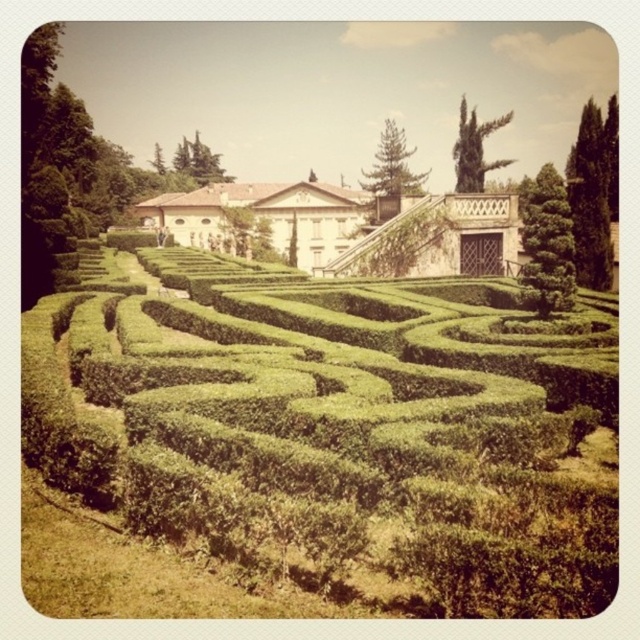
Question: Is white stone palace at center above green leafy bush at right?

Choices:
 (A) no
 (B) yes

Answer: (A)

Question: Can you confirm if green hedge maze at center is positioned to the right of green leafy bush at right?

Choices:
 (A) yes
 (B) no

Answer: (B)

Question: Which of the following is the closest to the observer?

Choices:
 (A) (224, 280)
 (B) (531, 202)
 (C) (406, 211)

Answer: (A)

Question: Can you confirm if white stone palace at center is positioned above green leafy bush at right?

Choices:
 (A) no
 (B) yes

Answer: (A)

Question: Considering the real-world distances, which object is farthest from the green hedge maze at center?

Choices:
 (A) white stone palace at center
 (B) green leafy bush at right

Answer: (A)

Question: Which point is farther from the camera taking this photo?

Choices:
 (A) (528, 284)
 (B) (292, 275)
 (C) (424, 225)

Answer: (C)